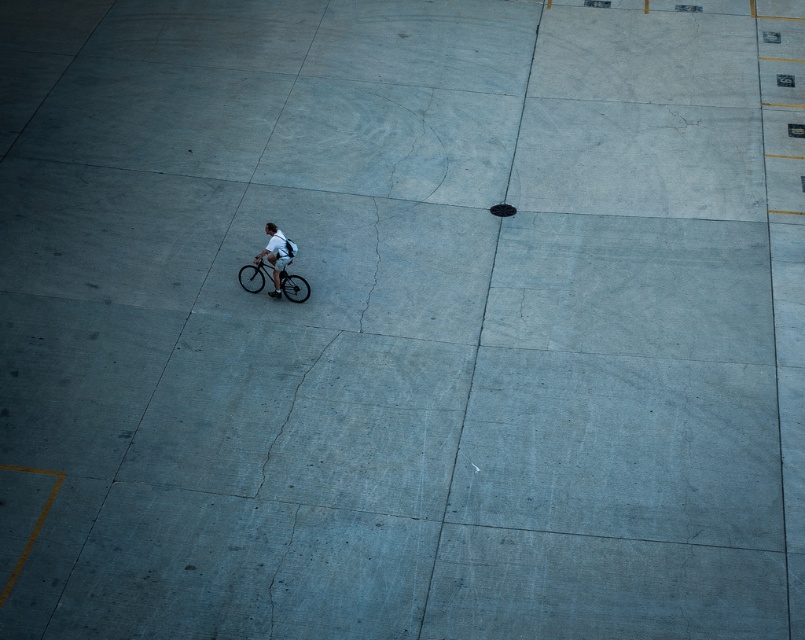
Who is more distant from viewer, (257, 282) or (265, 256)?

The point (257, 282) is behind.

Who is more distant from viewer, (257, 285) or (271, 269)?

Positioned behind is point (257, 285).

This screenshot has height=640, width=805. I want to click on shiny metallic bicycle at center, so click(x=254, y=275).